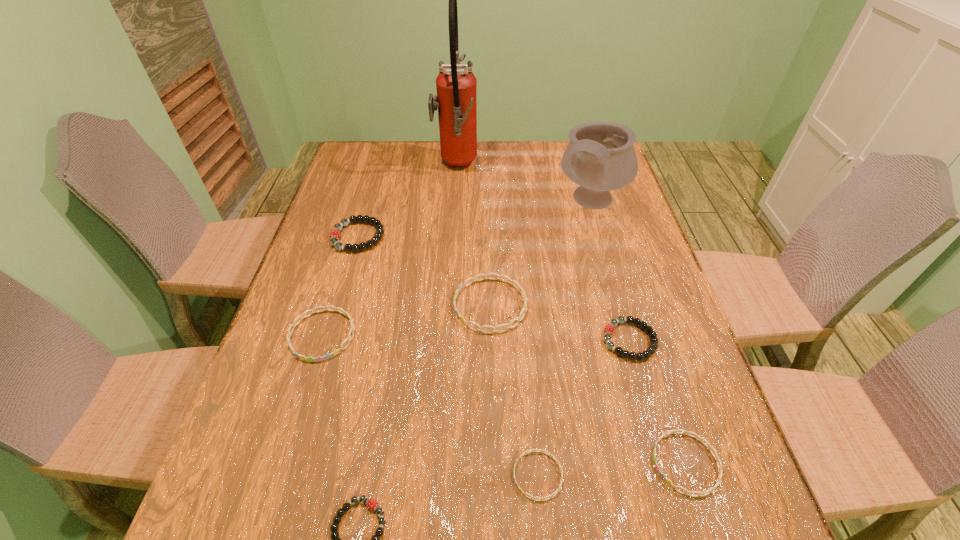
Find the location of `free space between the second smallest black bracelet and the rightmost blue bracelet`. free space between the second smallest black bracelet and the rightmost blue bracelet is located at coordinates (658, 402).

Select which object is the eighth closest to the second biggest blue bracelet. Please provide its 2D coordinates. Your answer should be formatted as a tuple, i.e. [(x, y)], where the tuple contains the x and y coordinates of a point satisfying the conditions above.

[(720, 470)]

Select which object is the third closest to the biggest blue bracelet. Please provide its 2D coordinates. Your answer should be formatted as a tuple, i.e. [(x, y)], where the tuple contains the x and y coordinates of a point satisfying the conditions above.

[(600, 157)]

The width and height of the screenshot is (960, 540). What are the coordinates of `bracelet that is the third closest one to the second smallest blue bracelet` in the screenshot? It's located at (480, 328).

Locate an element on the screen. Image resolution: width=960 pixels, height=540 pixels. bracelet object that ranks as the fourth closest to the leftmost blue bracelet is located at coordinates (531, 450).

Select which blue bracelet is the second closest to the biggest black bracelet. Please provide its 2D coordinates. Your answer should be formatted as a tuple, i.e. [(x, y)], where the tuple contains the x and y coordinates of a point satisfying the conditions above.

[(480, 328)]

This screenshot has width=960, height=540. I want to click on blue bracelet that is the third closest one to the tallest object, so pos(531,450).

Locate which black bracelet is the third closest to the tallest object. Please provide its 2D coordinates. Your answer should be formatted as a tuple, i.e. [(x, y)], where the tuple contains the x and y coordinates of a point satisfying the conditions above.

[(372, 504)]

Where is `the closest black bracelet to the pottery`? The height and width of the screenshot is (540, 960). the closest black bracelet to the pottery is located at coordinates (609, 329).

Find the location of a particular element. free space that satisfies the following two spatial constraints: 1. on the surface of the biggest blue bracelet showing star-shaped elements; 2. on the surface of the leftmost blue bracelet showing star-shaped elements is located at coordinates (492, 335).